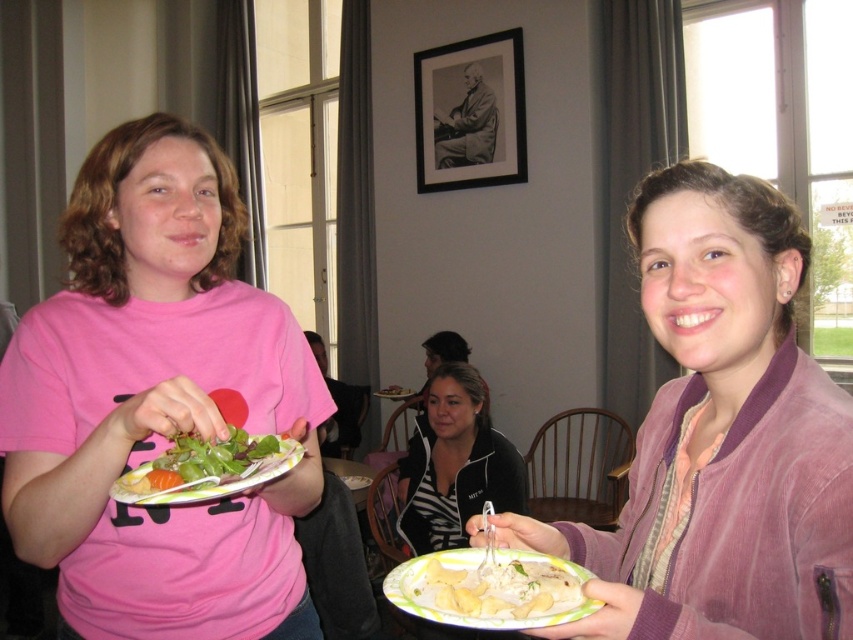
Looking at this image, is matte purple jacket at right taller than white paper plate at lower center?

Indeed, matte purple jacket at right has a greater height compared to white paper plate at lower center.

From the picture: Who is more distant from viewer, (x=643, y=284) or (x=556, y=568)?

The point (x=643, y=284) is behind.

Locate an element on the screen. This screenshot has height=640, width=853. matte purple jacket at right is located at coordinates (721, 436).

Based on the photo, who is lower down, pink matte shirt at center or matte plastic plate at center?

matte plastic plate at center

You are a GUI agent. You are given a task and a screenshot of the screen. Output one action in this format:
    pyautogui.click(x=<x>, y=<y>)
    Task: Click on the pink matte shirt at center
    The width and height of the screenshot is (853, 640).
    Given the screenshot: What is the action you would take?
    pyautogui.click(x=155, y=403)

Between matte purple jacket at right and matte plastic plate at center, which one has more height?

Standing taller between the two is matte purple jacket at right.

Can you confirm if matte purple jacket at right is positioned to the left of matte plastic plate at center?

In fact, matte purple jacket at right is to the right of matte plastic plate at center.

The image size is (853, 640). Find the location of `matte purple jacket at right`. matte purple jacket at right is located at coordinates (721, 436).

Image resolution: width=853 pixels, height=640 pixels. In order to click on matte purple jacket at right in this screenshot , I will do `click(721, 436)`.